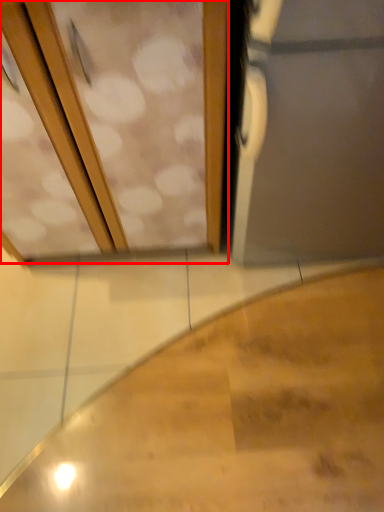
Question: From the image's perspective, where is screen door (annotated by the red box) located in relation to stairs in the image?

Choices:
 (A) above
 (B) below

Answer: (A)